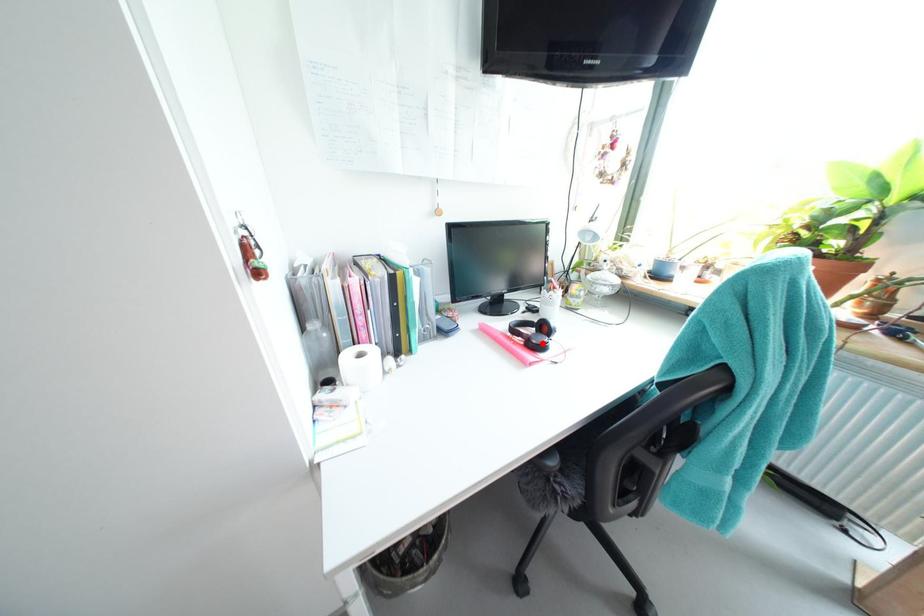
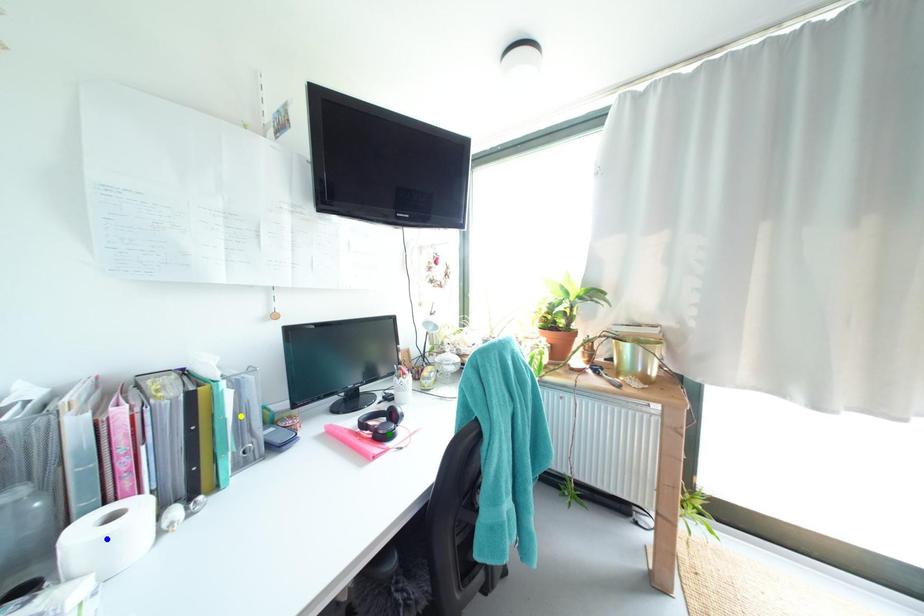
Question: I am providing you with two images of the same scene from different viewpoints. A red point is marked on the first image. You are given multiple points on the second image. Which mark in image 2 goes with the point in image 1?

Choices:
 (A) green point
 (B) blue point
 (C) yellow point

Answer: (A)